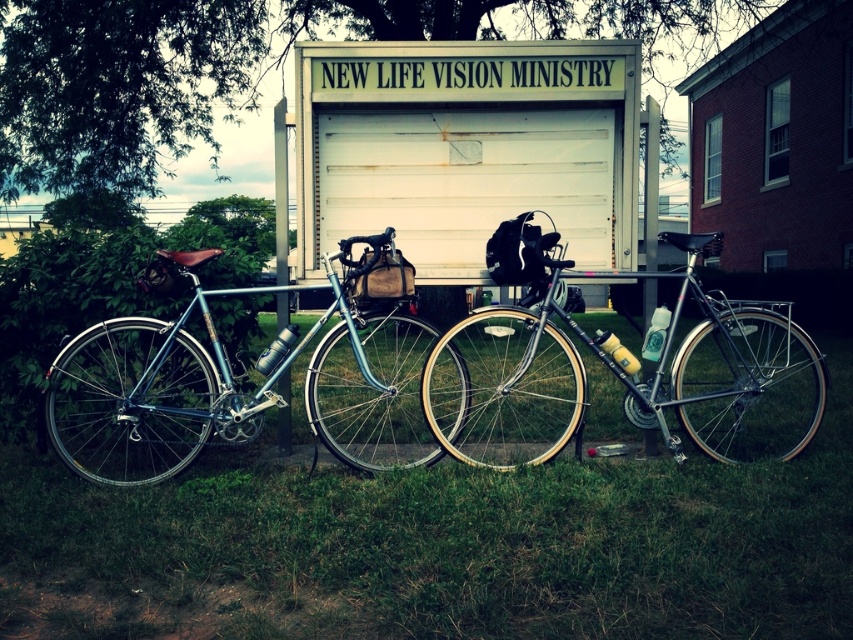
Question: Does shiny blue bicycle at center appear over white matte garage door at center?

Choices:
 (A) no
 (B) yes

Answer: (A)

Question: Estimate the real-world distances between objects in this image. Which object is closer to the shiny blue bicycle at center?

Choices:
 (A) white matte garage door at center
 (B) shiny silver bicycle at center

Answer: (A)

Question: Which of the following is the closest to the observer?

Choices:
 (A) (148, 376)
 (B) (489, 442)

Answer: (A)

Question: Which object is positioned farthest from the shiny silver bicycle at center?

Choices:
 (A) white matte garage door at center
 (B) shiny blue bicycle at center

Answer: (B)

Question: From the image, what is the correct spatial relationship of green grass at lower center in relation to shiny silver bicycle at center?

Choices:
 (A) above
 (B) below

Answer: (B)

Question: Can you confirm if green grass at lower center is positioned above white matte garage door at center?

Choices:
 (A) no
 (B) yes

Answer: (A)